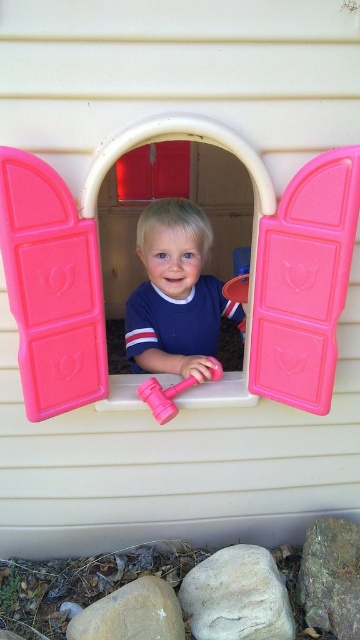
You are standing in front of the playhouse and notice two points on its structure. The first point is at coordinates point (51,342) and the second is at point (200,246). Which point is closer to you?

Point (51,342) is closer to the viewer than point (200,246).

You are a photographer taking a picture of the matte blue shirt at center and the pink rubber hammer at center. Which object will appear larger in the photo?

The matte blue shirt at center will appear larger in the photo because it is closer to the viewer than the pink rubber hammer at center.

You are a parent trying to choose between two hammers for your child. The child is currently holding the pink plastic hammer at center and the pink rubber hammer at center. Which hammer is taller?

The pink plastic hammer at center is taller than the pink rubber hammer at center according to the description.